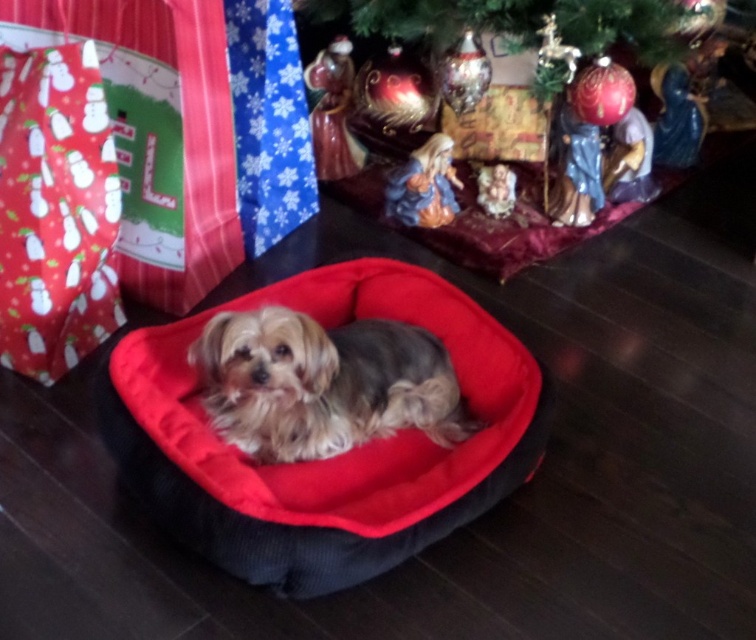
Question: Is velvet-like red dog bed at center further to camera compared to shiny green christmas tree at upper center?

Choices:
 (A) yes
 (B) no

Answer: (B)

Question: Is velvet-like red dog bed at center above shiny green christmas tree at upper center?

Choices:
 (A) no
 (B) yes

Answer: (A)

Question: Is velvet-like red dog bed at center wider than shiny green christmas tree at upper center?

Choices:
 (A) yes
 (B) no

Answer: (B)

Question: Which object is closer to the camera taking this photo?

Choices:
 (A) soft fur dog at center
 (B) shiny green christmas tree at upper center

Answer: (A)

Question: Among these objects, which one is nearest to the camera?

Choices:
 (A) shiny green christmas tree at upper center
 (B) velvet-like red dog bed at center
 (C) soft fur dog at center

Answer: (B)

Question: Which object is closer to the camera taking this photo?

Choices:
 (A) shiny green christmas tree at upper center
 (B) velvet-like red dog bed at center

Answer: (B)